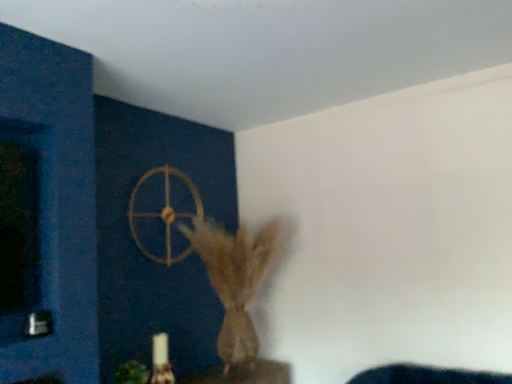
Question: Does gold metallic wheel at upper center appear on the right side of brown textured vase at center?

Choices:
 (A) no
 (B) yes

Answer: (A)

Question: Is gold metallic wheel at upper center aimed at brown textured vase at center?

Choices:
 (A) no
 (B) yes

Answer: (B)

Question: From the image's perspective, would you say gold metallic wheel at upper center is shown under brown textured vase at center?

Choices:
 (A) no
 (B) yes

Answer: (A)

Question: Considering the relative sizes of gold metallic wheel at upper center and brown textured vase at center in the image provided, is gold metallic wheel at upper center thinner than brown textured vase at center?

Choices:
 (A) yes
 (B) no

Answer: (A)

Question: Is gold metallic wheel at upper center smaller than brown textured vase at center?

Choices:
 (A) yes
 (B) no

Answer: (A)

Question: Considering the positions of point (260, 236) and point (169, 259), is point (260, 236) closer or farther from the camera than point (169, 259)?

Choices:
 (A) farther
 (B) closer

Answer: (B)

Question: Would you say brown textured vase at center is to the left or to the right of gold metallic wheel at upper center in the picture?

Choices:
 (A) right
 (B) left

Answer: (A)

Question: From a real-world perspective, relative to gold metallic wheel at upper center, is brown textured vase at center vertically above or below?

Choices:
 (A) below
 (B) above

Answer: (A)

Question: In the image, is brown textured vase at center positioned in front of or behind gold metallic wheel at upper center?

Choices:
 (A) behind
 (B) front

Answer: (B)

Question: Is gold metallic wheel at upper center inside or outside of brown textured vase at center?

Choices:
 (A) inside
 (B) outside

Answer: (B)

Question: From their relative heights in the image, would you say gold metallic wheel at upper center is taller or shorter than brown textured vase at center?

Choices:
 (A) tall
 (B) short

Answer: (B)

Question: From the image's perspective, is gold metallic wheel at upper center above or below brown textured vase at center?

Choices:
 (A) above
 (B) below

Answer: (A)

Question: In the image, is gold metallic wheel at upper center positioned in front of or behind brown textured vase at center?

Choices:
 (A) behind
 (B) front

Answer: (A)

Question: From the image's perspective, is gold metallic wheel at upper center above or below green matte plant at lower left?

Choices:
 (A) above
 (B) below

Answer: (A)

Question: From their relative heights in the image, would you say gold metallic wheel at upper center is taller or shorter than green matte plant at lower left?

Choices:
 (A) tall
 (B) short

Answer: (A)